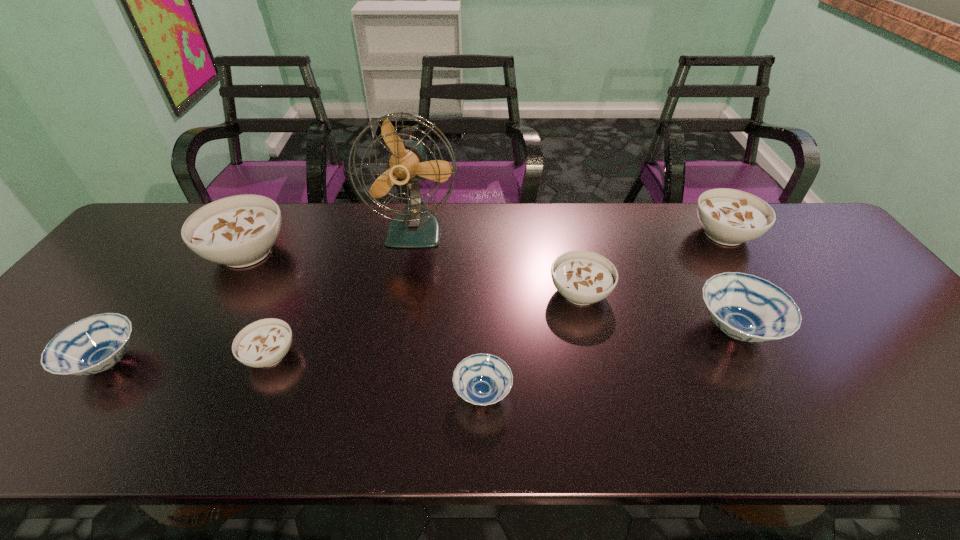
Find the location of a particular element. The image size is (960, 540). soup bowl object that ranks as the sixth closest to the rightmost white soup bowl is located at coordinates (94, 344).

Choose which white soup bowl is the nearest neighbor to the blue fan. Please provide its 2D coordinates. Your answer should be formatted as a tuple, i.e. [(x, y)], where the tuple contains the x and y coordinates of a point satisfying the conditions above.

[(238, 231)]

Identify which white soup bowl is the fourth closest to the biggest blue soup bowl. Please provide its 2D coordinates. Your answer should be formatted as a tuple, i.e. [(x, y)], where the tuple contains the x and y coordinates of a point satisfying the conditions above.

[(238, 231)]

Choose which blue soup bowl is the second nearest neighbor to the biggest white soup bowl. Please provide its 2D coordinates. Your answer should be formatted as a tuple, i.e. [(x, y)], where the tuple contains the x and y coordinates of a point satisfying the conditions above.

[(482, 379)]

This screenshot has height=540, width=960. Identify the location of blue soup bowl that is the third closest to the nearest white soup bowl. (745, 307).

This screenshot has width=960, height=540. I want to click on vacant space that satisfies the following two spatial constraints: 1. on the back side of the third object from right to left; 2. on the right side of the second white soup bowl from left to right, so click(296, 293).

Where is `free space that satisfies the following two spatial constraints: 1. on the back side of the biggest blue soup bowl; 2. on the right side of the fourth soup bowl from left to right`? This screenshot has height=540, width=960. free space that satisfies the following two spatial constraints: 1. on the back side of the biggest blue soup bowl; 2. on the right side of the fourth soup bowl from left to right is located at coordinates (482, 329).

At what (x,y) coordinates should I click in order to perform the action: click on vacant space that satisfies the following two spatial constraints: 1. on the back side of the third soup bowl from right to left; 2. on the right side of the nearest white soup bowl. Please return your answer as a coordinate pair (x, y). Looking at the image, I should click on (296, 293).

What are the coordinates of `vacant position in the image that satisfies the following two spatial constraints: 1. on the back side of the leftmost white soup bowl; 2. on the right side of the third smallest white soup bowl` in the screenshot? It's located at (257, 234).

Identify the location of free spot that satisfies the following two spatial constraints: 1. on the front-facing side of the fourth object from left to right for air flow; 2. on the right side of the third white soup bowl from left to right. (405, 293).